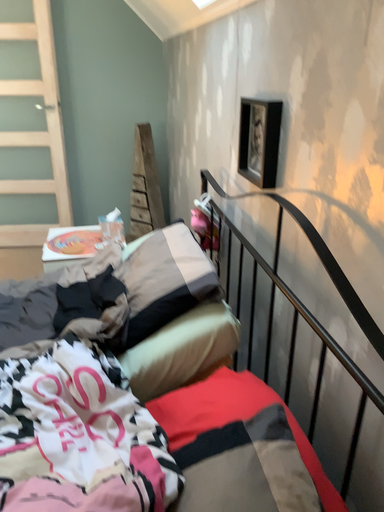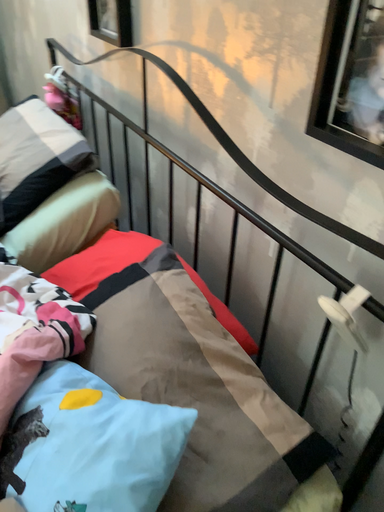
Question: How did the camera likely rotate when shooting the video?

Choices:
 (A) rotated left
 (B) rotated right

Answer: (B)